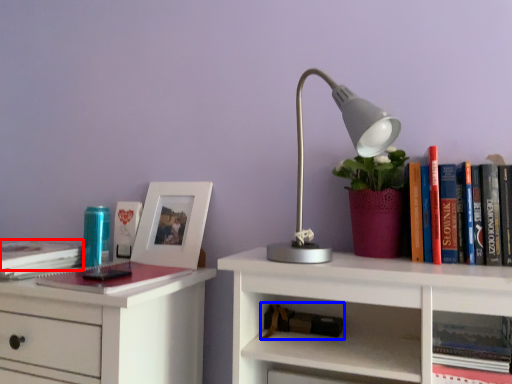
Question: Among these objects, which one is nearest to the camera, book (highlighted by a red box) or book (highlighted by a blue box)?

Choices:
 (A) book
 (B) book

Answer: (A)